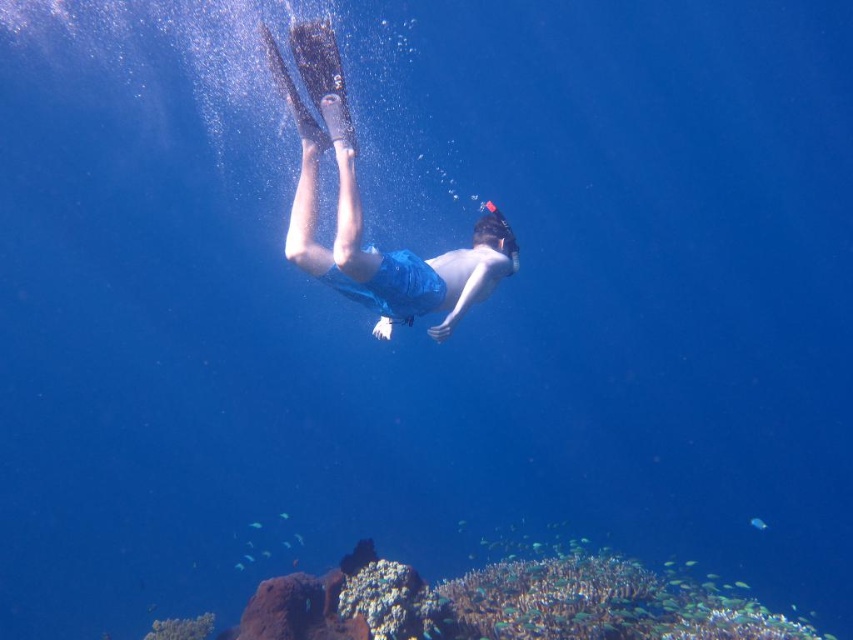
You are a snorkeler observing the underwater scene. You notice the white coral reef at lower center and the blue fabric shorts at center. Which object is wider in this view?

The white coral reef at lower center is wider than the blue fabric shorts at center.

You are navigating an underwater drone and need to position it between two points marked in the scene. The first point is at coordinates point [372,593] and the second is at point [341,156]. Which point should you move the drone towards if you want it to be closer to the snorkeler?

Point [341,156] is closer to the snorkeler because it is in front of point [372,593], which is behind it.